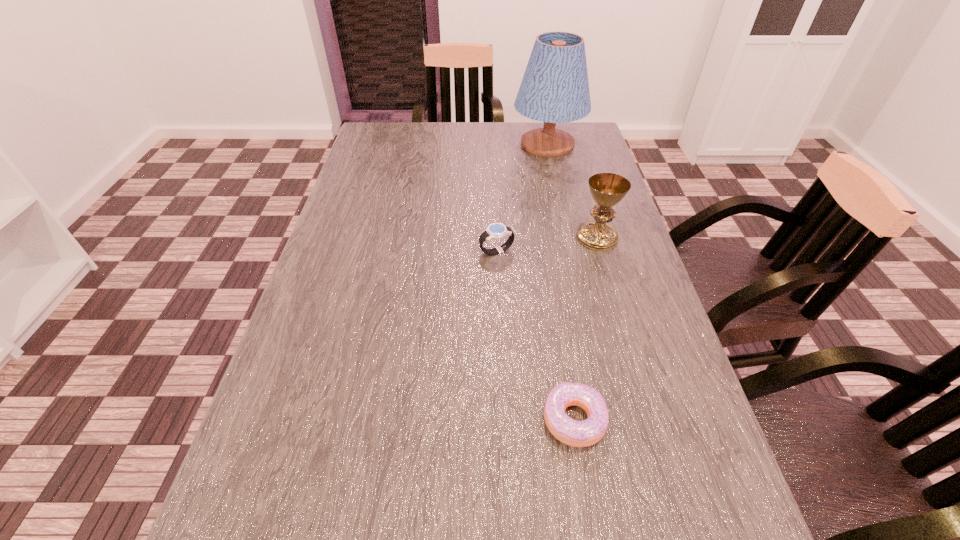
You are a GUI agent. You are given a task and a screenshot of the screen. Output one action in this format:
    pyautogui.click(x=<x>, y=<y>)
    Task: Click on the unoccupied area between the chalice and the tallest object
    
    Given the screenshot: What is the action you would take?
    pyautogui.click(x=572, y=191)

Where is `empty location between the second shortest object and the shortest object`? The width and height of the screenshot is (960, 540). empty location between the second shortest object and the shortest object is located at coordinates (535, 335).

This screenshot has width=960, height=540. Find the location of `blank region between the chalice and the tallest object`. blank region between the chalice and the tallest object is located at coordinates (572, 191).

Locate an element on the screen. The image size is (960, 540). free spot between the second tallest object and the second shortest object is located at coordinates (546, 244).

At what (x,y) coordinates should I click in order to perform the action: click on free area in between the shortest object and the watch. Please return your answer as a coordinate pair (x, y). This screenshot has width=960, height=540. Looking at the image, I should click on (535, 335).

Where is `empty space between the shortest object and the tallest object`? empty space between the shortest object and the tallest object is located at coordinates (561, 282).

I want to click on free space between the shortest object and the chalice, so click(x=586, y=328).

Image resolution: width=960 pixels, height=540 pixels. I want to click on vacant space that is in between the doughnut and the lampshade, so click(x=561, y=282).

Locate an element on the screen. unoccupied position between the doughnut and the leftmost object is located at coordinates (535, 335).

Where is `object that is the nearest to the lampshade`? The height and width of the screenshot is (540, 960). object that is the nearest to the lampshade is located at coordinates (607, 189).